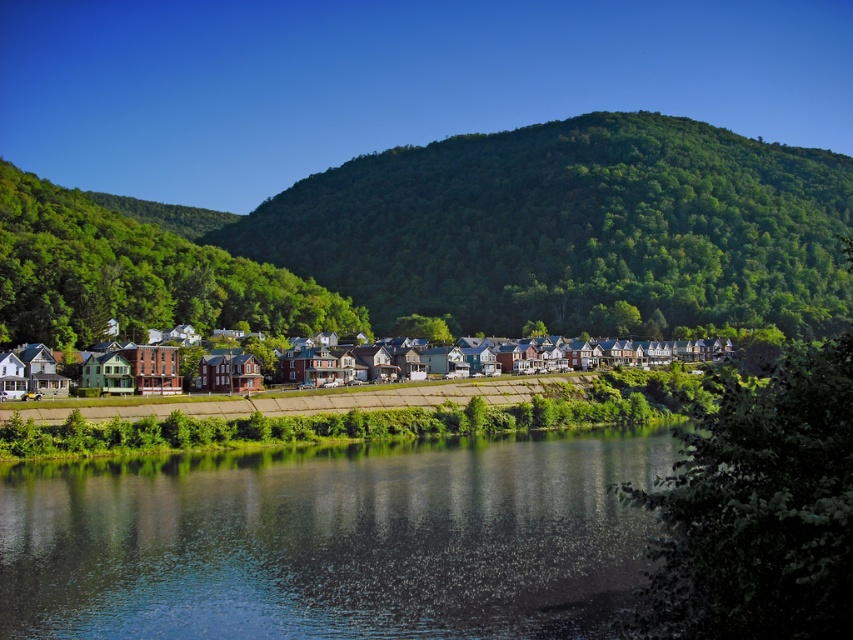
You are standing at the edge of the water and want to take a photo of both the smooth reflective water at center and the multicolored brick houses at center. Which object will appear larger in your photo?

The smooth reflective water at center will appear larger in the photo because it is closer to the viewer than the multicolored brick houses at center.